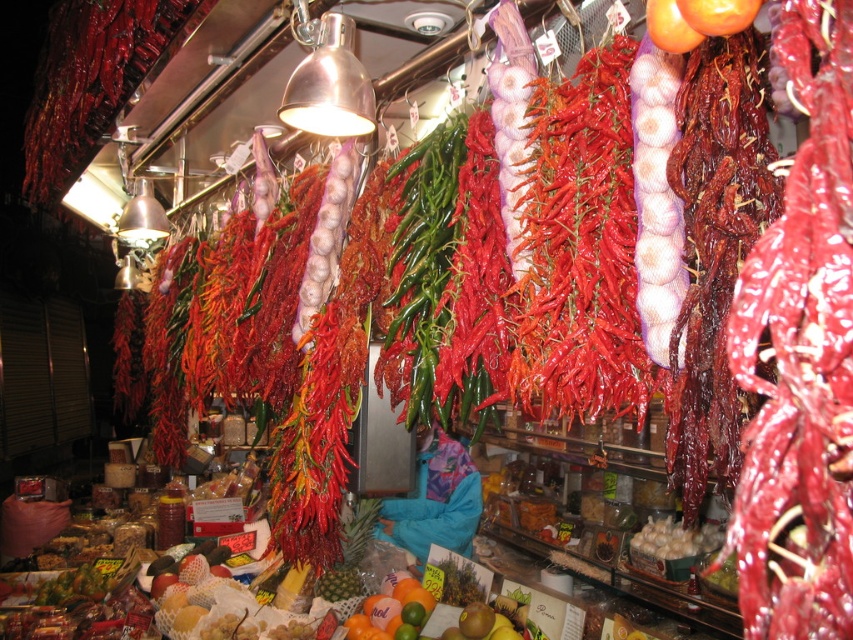
Question: Which object appears closest to the camera in this image?

Choices:
 (A) smooth orange citrus at lower center
 (B) white/glossy onion at center

Answer: (B)

Question: Is white/glossy onion at center to the left of smooth orange citrus at lower center from the viewer's perspective?

Choices:
 (A) no
 (B) yes

Answer: (A)

Question: Which point is closer to the camera?

Choices:
 (A) (672, 220)
 (B) (363, 605)

Answer: (A)

Question: Does white/glossy onion at center appear on the left side of smooth orange citrus at lower center?

Choices:
 (A) no
 (B) yes

Answer: (A)

Question: Which point appears farthest from the camera in this image?

Choices:
 (A) (633, 147)
 (B) (409, 632)

Answer: (B)

Question: Is the position of white/glossy onion at center less distant than that of smooth orange citrus at lower center?

Choices:
 (A) no
 (B) yes

Answer: (B)